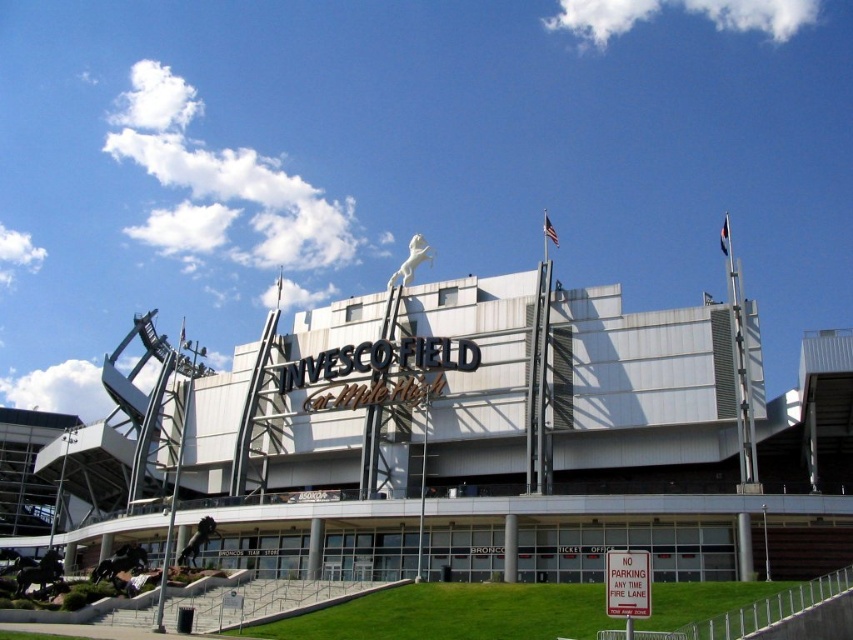
You are standing at the entrance of Invesco Field at Mile High and see two points marked on the building facade. The first point is at coordinate point (x=102, y=561) and the second is at coordinate point (x=201, y=541). From your vantage point, which point is closer to you?

Point (x=201, y=541) is closer to you because point (x=102, y=561) is behind it.

You are a groundskeeper at Invesco Field at Mile High. You need to move a 12 meter long irrigation hose from the polished bronze horse at lower left to the bronze statue at lower center. Can you lay the hose directly between them without any obstacles?

The distance between the polished bronze horse at lower left and the bronze statue at lower center is 11.81 meters. Since the hose is 12 meters long, it is long enough to span the distance between them. Therefore, you can lay the hose directly between them without any obstacles.